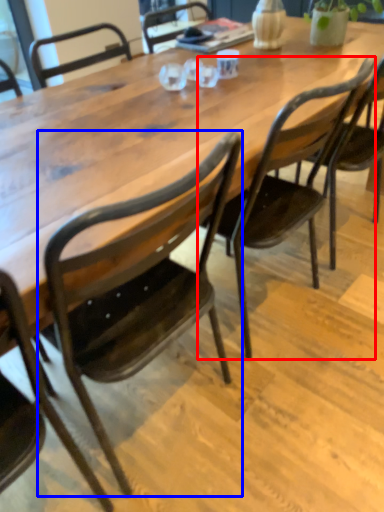
Question: Which of the following is the farthest to the observer, chair (highlighted by a red box) or chair (highlighted by a blue box)?

Choices:
 (A) chair
 (B) chair

Answer: (A)